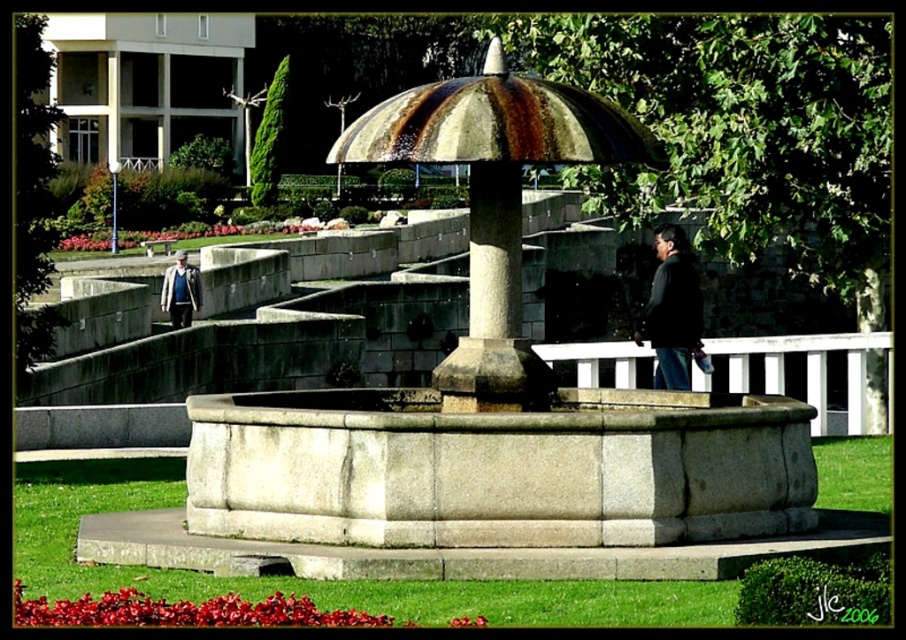
You are a photographer trying to capture both the dark gray jacket at center and the dark blue jacket at center in a single frame. Given that your camera has a maximum focus range of 20 meters, will you be able to include both subjects in your shot?

The dark gray jacket at center and dark blue jacket at center are 23.14 meters apart from each other, which exceeds the camera maximum focus range of 20 meters. Therefore, you cannot capture both in a single frame.

You are a photographer trying to capture both the dark gray jacket at center and the dark blue jacket at center in a single frame. Which jacket will appear larger in the photo?

The dark gray jacket at center will appear larger in the photo because it is taller than the dark blue jacket at center.

You are standing at the point marked as point (495, 390) in the park. What is the closest object to you?

The closest object to point (495, 390) is the rusty stone fountain at center since the point is located on it.